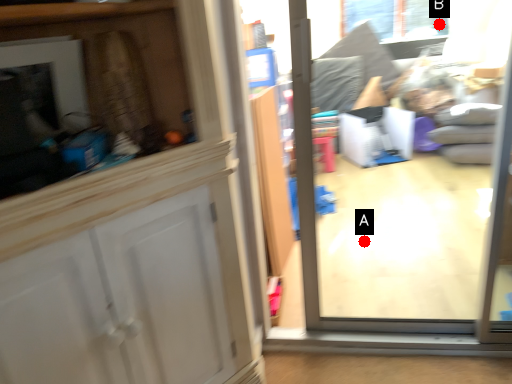
Question: Two points are circled on the image, labeled by A and B beside each circle. Which point appears closest to the camera in this image?

Choices:
 (A) A is closer
 (B) B is closer

Answer: (A)